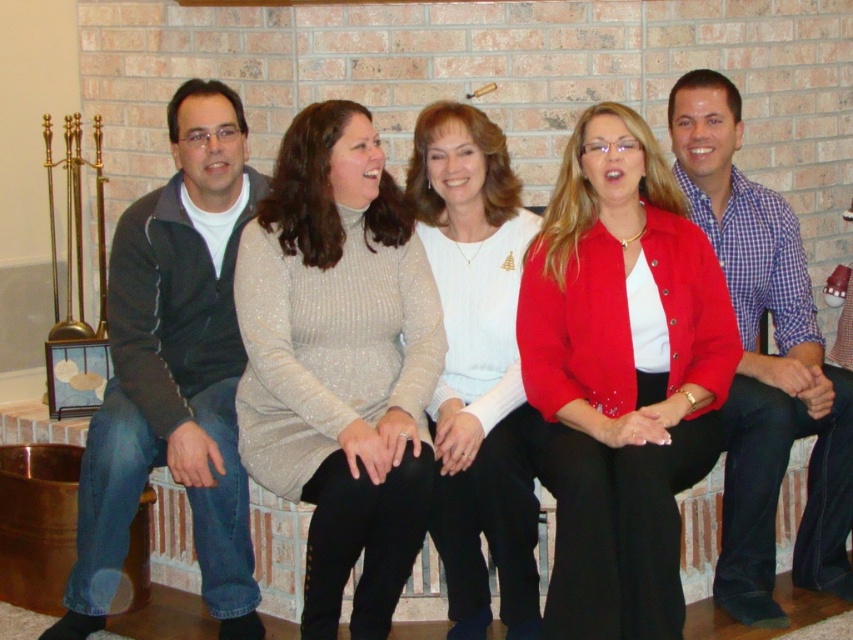
Who is more distant from viewer, [370,444] or [128,403]?

The point [128,403] is more distant.

From the picture: Which of these two, sparkly beige sweater at center or black matte jacket at left, stands taller?

Answer: black matte jacket at left is taller.

I want to click on sparkly beige sweater at center, so click(339, 362).

Is matte red jacket at center shorter than white glittery sweater at center?

Yes, matte red jacket at center is shorter than white glittery sweater at center.

Between point (641, 321) and point (489, 310), which one is positioned behind?

The point (489, 310) is behind.

Locate an element on the screen. matte red jacket at center is located at coordinates point(621,376).

Between black matte jacket at left and white glittery sweater at center, which one has more height?

black matte jacket at left

Measure the distance between black matte jacket at left and camera.

black matte jacket at left is 3.76 meters from camera.

Which is behind, point (196, 388) or point (448, 365)?

The point (196, 388) is behind.

Locate an element on the screen. This screenshot has width=853, height=640. black matte jacket at left is located at coordinates (173, 371).